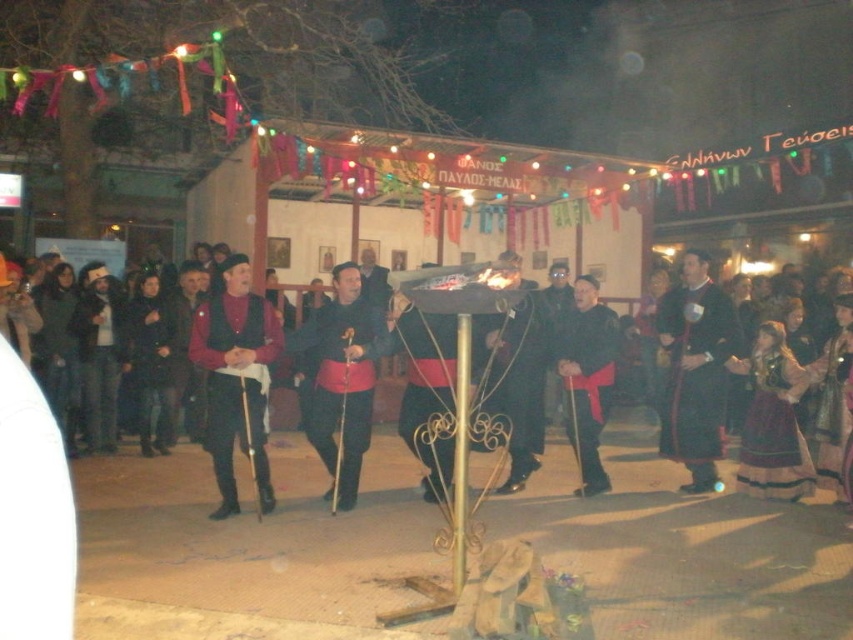
Does matte black robe at center come behind black velvet robe at center?

No, it is in front of black velvet robe at center.

Who is more forward, [363,360] or [589,337]?

Point [363,360] is more forward.

Locate an element on the screen. matte black robe at center is located at coordinates (341, 380).

Does dark clothing crowd at center appear under velvet dark blue robe at center?

Yes.

Is dark clothing crowd at center thinner than velvet dark blue robe at center?

No.

Which is in front, point (477, 298) or point (695, 365)?

Point (477, 298)

Locate an element on the screen. dark clothing crowd at center is located at coordinates [x=235, y=337].

Between dark clothing crowd at center and matte black vest at center, which one has less height?

With less height is dark clothing crowd at center.

Locate an element on the screen. dark clothing crowd at center is located at coordinates (235, 337).

Where is `dark clothing crowd at center`? The height and width of the screenshot is (640, 853). dark clothing crowd at center is located at coordinates (235, 337).